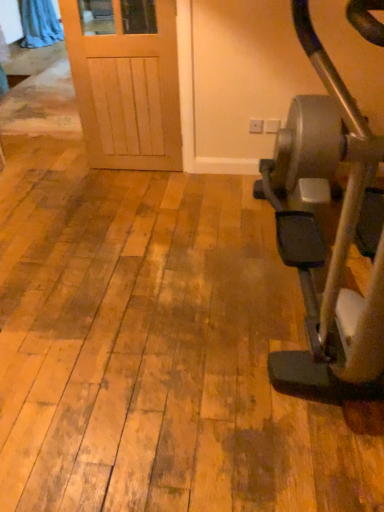
Question: Does metallic gray stationary bicycle at right turn towards blue fabric curtain at upper left?

Choices:
 (A) yes
 (B) no

Answer: (B)

Question: Considering the relative sizes of metallic gray stationary bicycle at right and blue fabric curtain at upper left in the image provided, is metallic gray stationary bicycle at right taller than blue fabric curtain at upper left?

Choices:
 (A) no
 (B) yes

Answer: (B)

Question: Is metallic gray stationary bicycle at right positioned before blue fabric curtain at upper left?

Choices:
 (A) yes
 (B) no

Answer: (A)

Question: Does metallic gray stationary bicycle at right have a larger size compared to blue fabric curtain at upper left?

Choices:
 (A) no
 (B) yes

Answer: (B)

Question: Is metallic gray stationary bicycle at right not within blue fabric curtain at upper left?

Choices:
 (A) no
 (B) yes

Answer: (B)

Question: Is metallic gray stationary bicycle at right shorter than blue fabric curtain at upper left?

Choices:
 (A) no
 (B) yes

Answer: (A)

Question: Is blue fabric curtain at upper left not near metallic gray stationary bicycle at right?

Choices:
 (A) yes
 (B) no

Answer: (A)

Question: Considering the relative sizes of blue fabric curtain at upper left and metallic gray stationary bicycle at right in the image provided, is blue fabric curtain at upper left thinner than metallic gray stationary bicycle at right?

Choices:
 (A) yes
 (B) no

Answer: (A)

Question: Could you tell me if blue fabric curtain at upper left is facing metallic gray stationary bicycle at right?

Choices:
 (A) no
 (B) yes

Answer: (A)

Question: Would you say metallic gray stationary bicycle at right is part of blue fabric curtain at upper left's contents?

Choices:
 (A) no
 (B) yes

Answer: (A)

Question: Can you confirm if blue fabric curtain at upper left is wider than metallic gray stationary bicycle at right?

Choices:
 (A) no
 (B) yes

Answer: (A)

Question: Considering the relative positions of blue fabric curtain at upper left and metallic gray stationary bicycle at right in the image provided, is blue fabric curtain at upper left to the right of metallic gray stationary bicycle at right from the viewer's perspective?

Choices:
 (A) no
 (B) yes

Answer: (A)

Question: Considering their positions, is metallic gray stationary bicycle at right located in front of or behind blue fabric curtain at upper left?

Choices:
 (A) front
 (B) behind

Answer: (A)